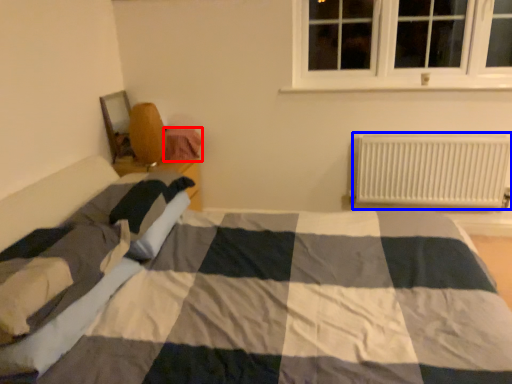
Question: Which of the following is the farthest to the observer, material (highlighted by a red box) or radiator (highlighted by a blue box)?

Choices:
 (A) material
 (B) radiator

Answer: (A)